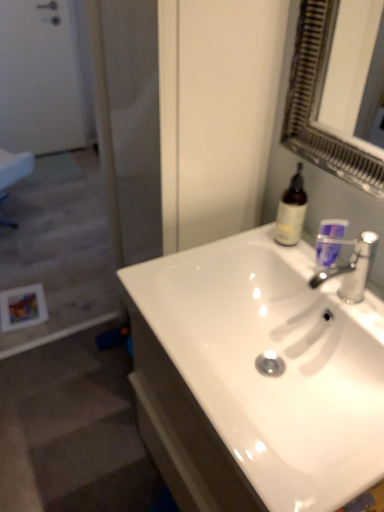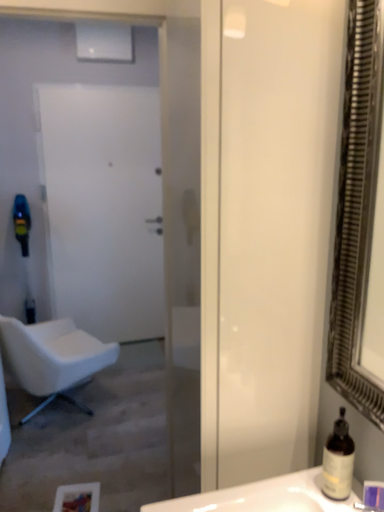
Question: Which way did the camera rotate in the video?

Choices:
 (A) rotated left
 (B) rotated right

Answer: (A)